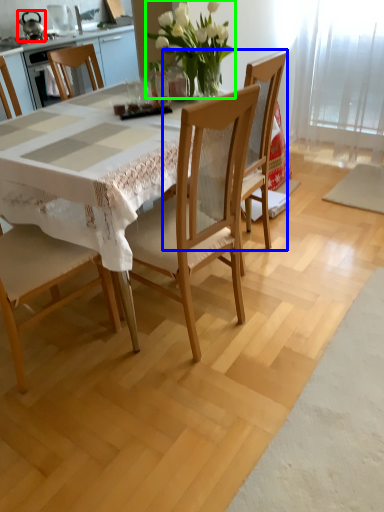
Question: Which object is the farthest from appliance (highlighted by a red box)? Choose among these: chair (highlighted by a blue box) or floral arrangement (highlighted by a green box).

Choices:
 (A) chair
 (B) floral arrangement

Answer: (A)